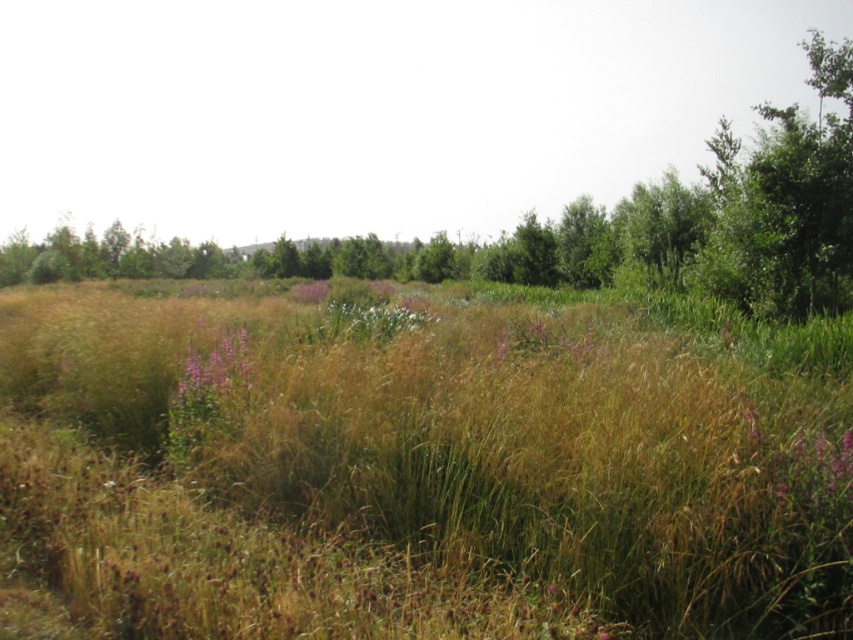
Between point (187, 356) and point (302, 292), which one is positioned behind?

Point (302, 292)

Is point (216, 388) closer to camera compared to point (315, 291)?

Yes.

Is point (209, 364) farther from viewer compared to point (317, 298)?

No, (209, 364) is in front of (317, 298).

The image size is (853, 640). I want to click on purple matte flower at center, so click(213, 378).